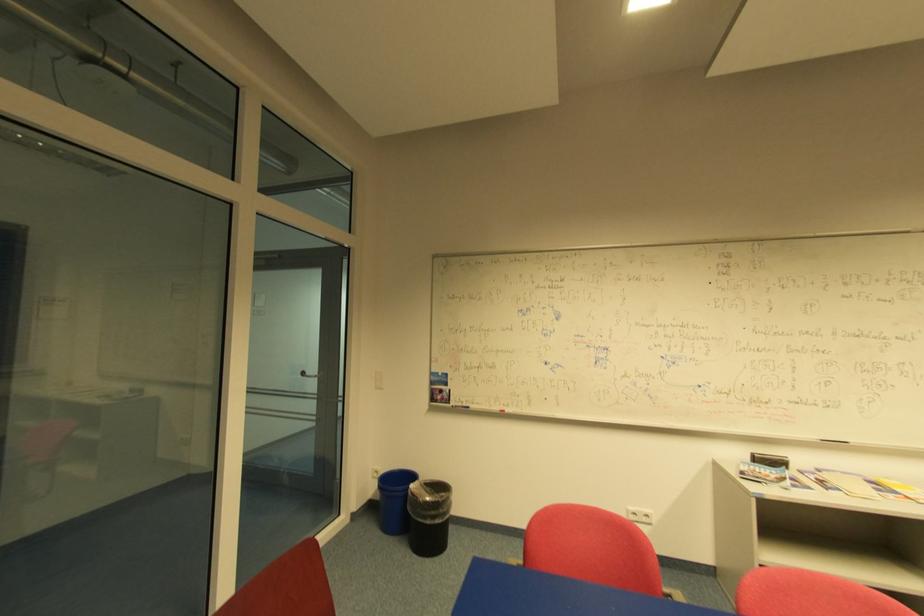
Find where to wip the whiteboard eraser. Please return your answer as a coordinate pair (x, y).

(833, 440)